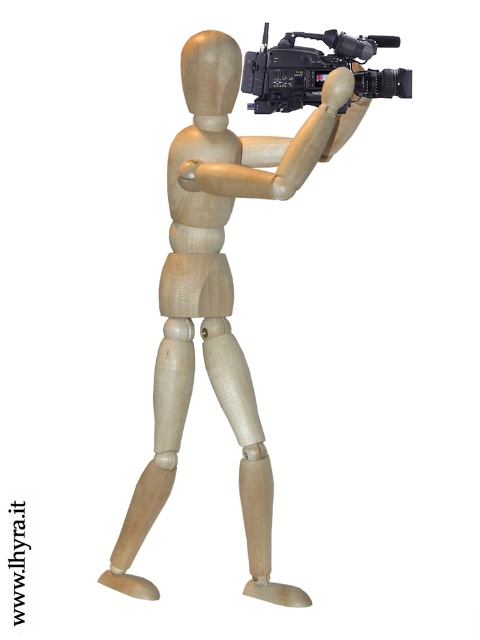
Is natural wood mannequin at center smaller than black plastic video camera at upper center?

Incorrect, natural wood mannequin at center is not smaller in size than black plastic video camera at upper center.

Does natural wood mannequin at center appear on the right side of black plastic video camera at upper center?

Incorrect, natural wood mannequin at center is not on the right side of black plastic video camera at upper center.

You are a GUI agent. You are given a task and a screenshot of the screen. Output one action in this format:
    pyautogui.click(x=<x>, y=<y>)
    Task: Click on the natural wood mannequin at center
    
    Given the screenshot: What is the action you would take?
    pyautogui.click(x=218, y=292)

Locate an element on the screen. This screenshot has height=640, width=480. natural wood mannequin at center is located at coordinates (218, 292).